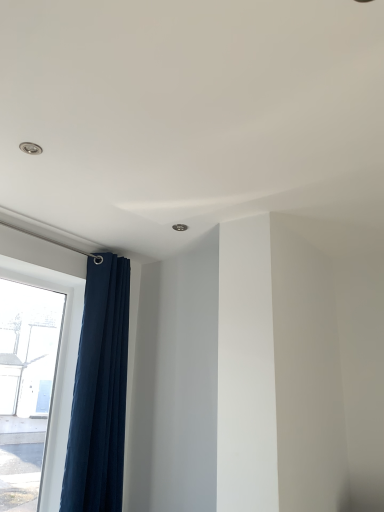
Question: Considering the relative positions of dark blue fabric curtain at left and transparent glass window at left in the image provided, is dark blue fabric curtain at left to the left or to the right of transparent glass window at left?

Choices:
 (A) left
 (B) right

Answer: (B)

Question: Relative to transparent glass window at left, is dark blue fabric curtain at left in front or behind?

Choices:
 (A) front
 (B) behind

Answer: (B)

Question: From the image's perspective, relative to transparent glass window at left, is dark blue fabric curtain at left above or below?

Choices:
 (A) below
 (B) above

Answer: (B)

Question: Do you think transparent glass window at left is within dark blue fabric curtain at left, or outside of it?

Choices:
 (A) inside
 (B) outside

Answer: (B)

Question: Is transparent glass window at left wider or thinner than dark blue fabric curtain at left?

Choices:
 (A) thin
 (B) wide

Answer: (A)

Question: Considering the positions of transparent glass window at left and dark blue fabric curtain at left in the image, is transparent glass window at left bigger or smaller than dark blue fabric curtain at left?

Choices:
 (A) big
 (B) small

Answer: (B)

Question: Considering the relative positions of transparent glass window at left and dark blue fabric curtain at left in the image provided, is transparent glass window at left to the left or to the right of dark blue fabric curtain at left?

Choices:
 (A) left
 (B) right

Answer: (A)